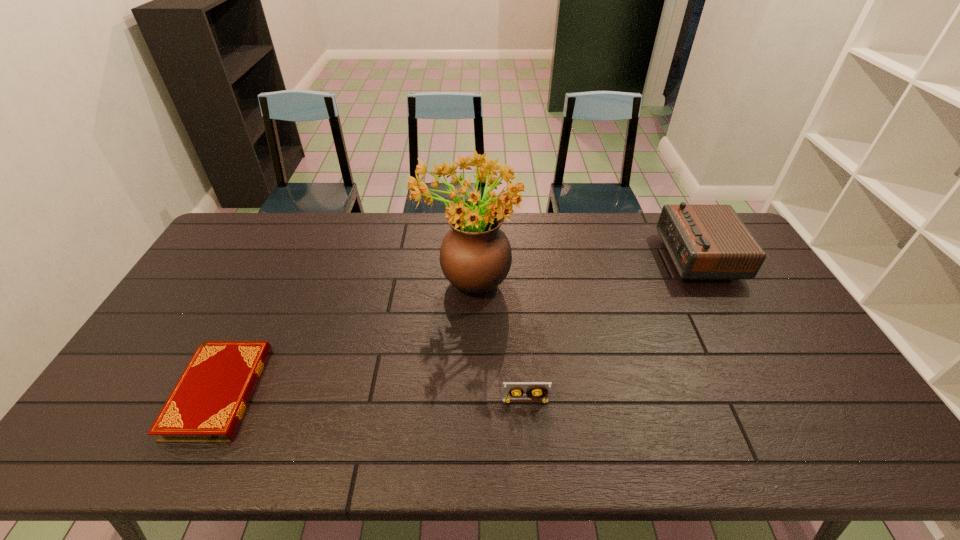
The width and height of the screenshot is (960, 540). Identify the location of vacant space that's between the shortest object and the rightmost object. (459, 324).

You are a GUI agent. You are given a task and a screenshot of the screen. Output one action in this format:
    pyautogui.click(x=<x>, y=<y>)
    Task: Click on the vacant area that lies between the rightmost object and the second shortest object
    Image resolution: width=960 pixels, height=540 pixels.
    Given the screenshot: What is the action you would take?
    pyautogui.click(x=612, y=329)

Find the location of `empty location between the tallest object and the third tallest object`. empty location between the tallest object and the third tallest object is located at coordinates (496, 340).

I want to click on free spot between the flower arrangement and the leftmost object, so click(344, 335).

Find the location of a particular element. free point between the radio receiver and the leftmost object is located at coordinates (459, 324).

What are the coordinates of `unoccupied position between the second shortest object and the third shortest object` in the screenshot? It's located at (612, 329).

Locate an element on the screen. This screenshot has width=960, height=540. free space between the third tallest object and the tallest object is located at coordinates (496, 340).

The height and width of the screenshot is (540, 960). I want to click on vacant space that's between the third shortest object and the leftmost object, so click(x=459, y=324).

Find the location of a particular element. vacant space in between the flower arrangement and the radio receiver is located at coordinates (583, 268).

You are a GUI agent. You are given a task and a screenshot of the screen. Output one action in this format:
    pyautogui.click(x=<x>, y=<y>)
    Task: Click on the empty location between the shortest object and the tallest object
    This screenshot has width=960, height=540.
    Given the screenshot: What is the action you would take?
    pyautogui.click(x=344, y=335)